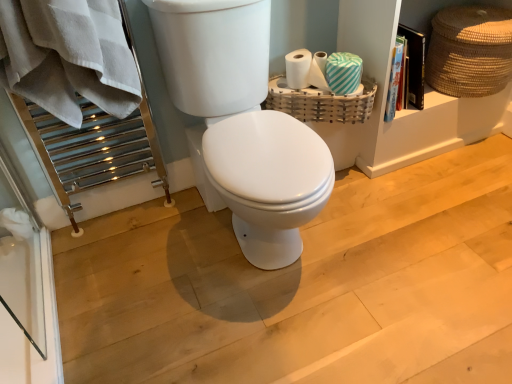
Find the location of a particular element. The image size is (512, 384). vacant area that is in front of white glossy toilet at center is located at coordinates (272, 330).